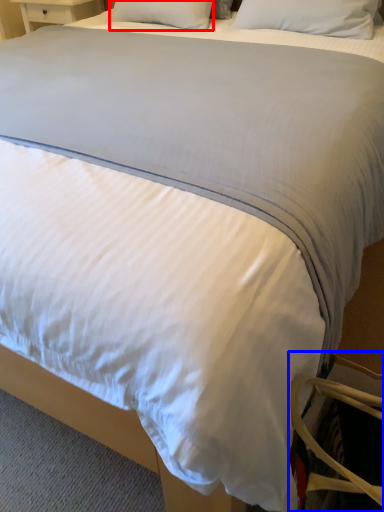
Question: Among these objects, which one is farthest to the camera, pillow (highlighted by a red box) or swivel chair (highlighted by a blue box)?

Choices:
 (A) pillow
 (B) swivel chair

Answer: (A)